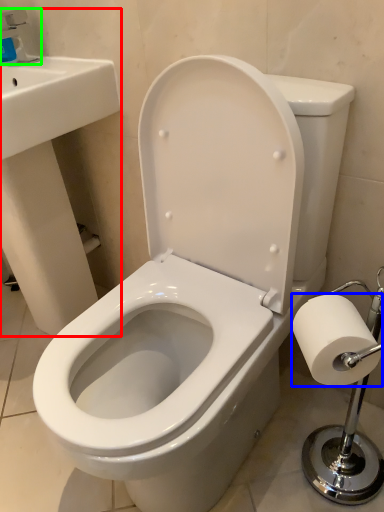
Question: Considering the real-world distances, which object is farthest from sink (highlighted by a red box)? toilet paper (highlighted by a blue box) or faucet (highlighted by a green box)?

Choices:
 (A) toilet paper
 (B) faucet

Answer: (A)